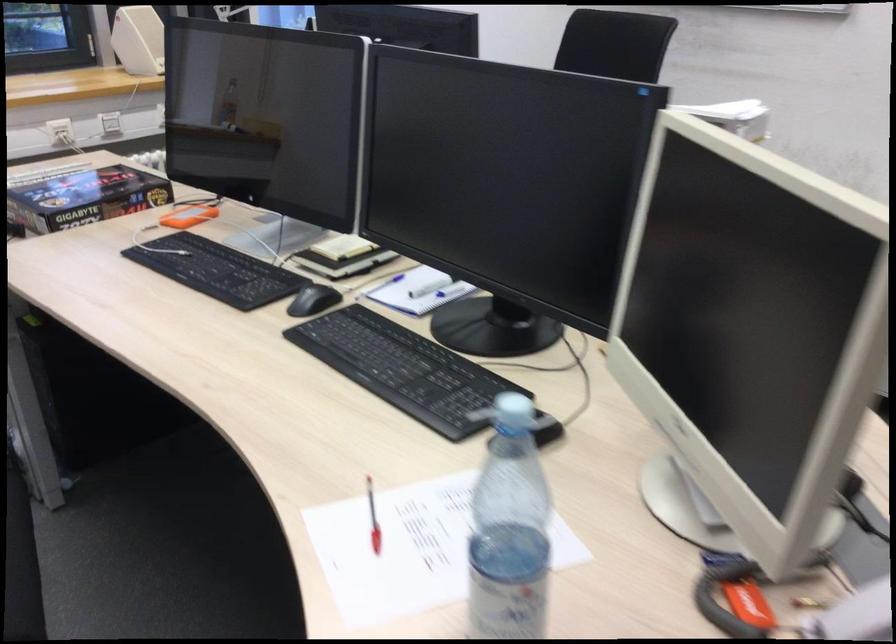
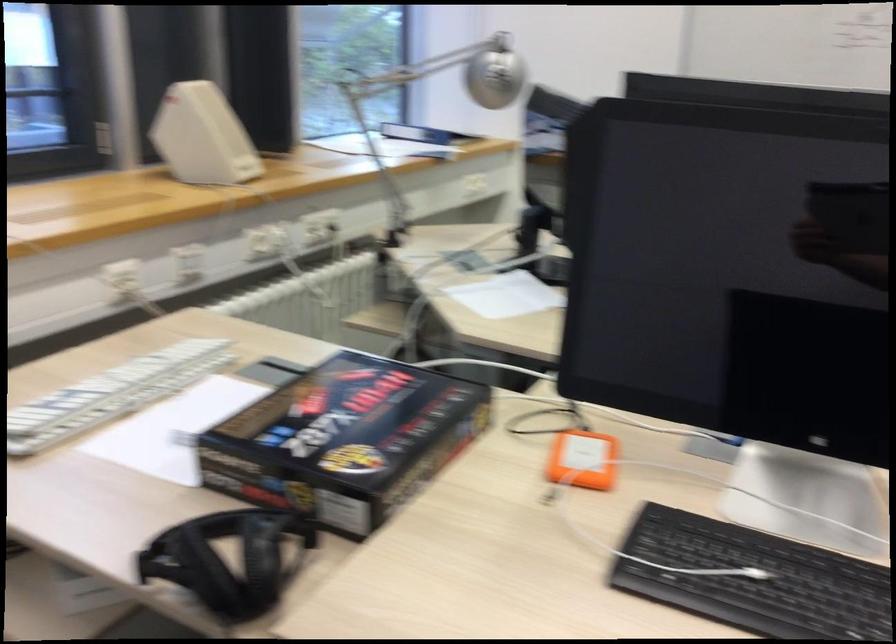
The point at (185, 219) is marked in the first image. Where is the corresponding point in the second image?

(582, 460)